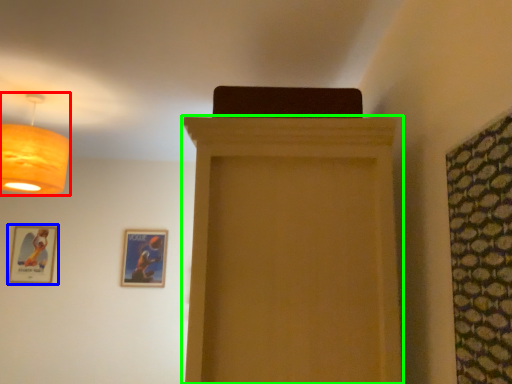
Question: Estimate the real-world distances between objects in this image. Which object is closer to lamp (highlighted by a red box), picture frame (highlighted by a blue box) or furniture (highlighted by a green box)?

Choices:
 (A) picture frame
 (B) furniture

Answer: (B)